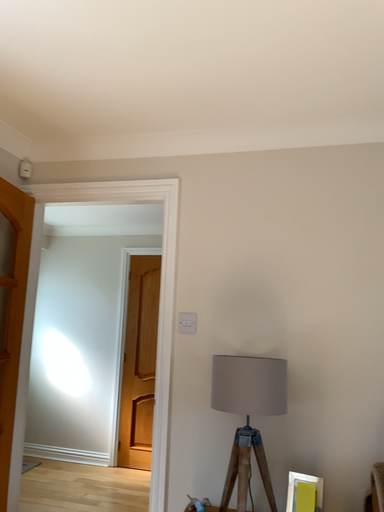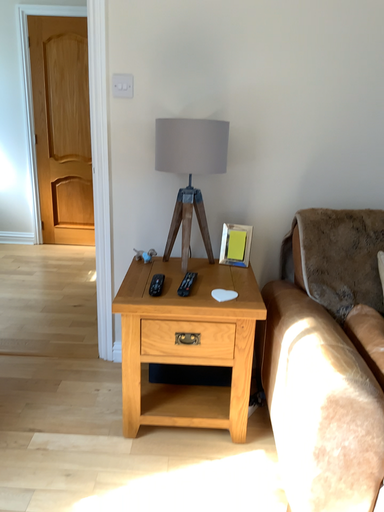
Question: How did the camera likely rotate when shooting the video?

Choices:
 (A) rotated downward
 (B) rotated upward

Answer: (A)